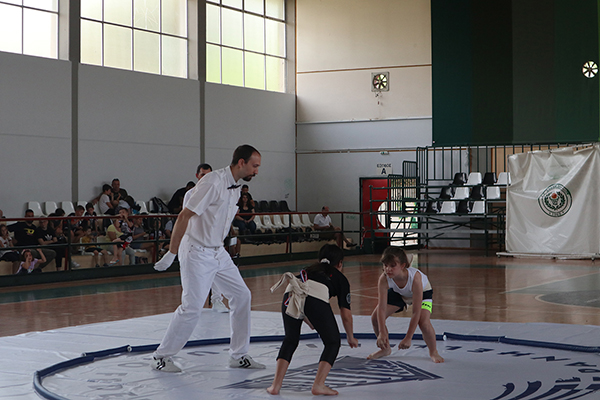
You are a GUI agent. You are given a task and a screenshot of the screen. Output one action in this format:
    pyautogui.click(x=<x>, y=<y>)
    Task: Click on the shoe
    The image size is (600, 400).
    Given the screenshot: What is the action you would take?
    pyautogui.click(x=168, y=365)